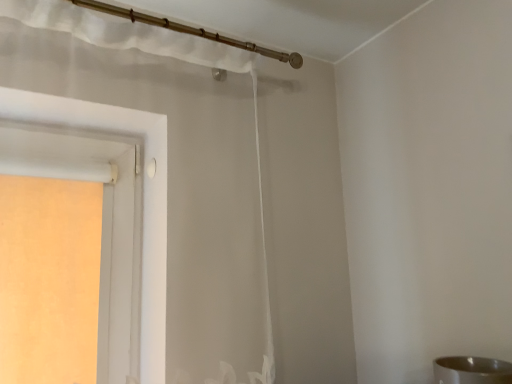
Question: From the image's perspective, does sheer white curtain at upper center appear higher than silver metallic sink at lower right?

Choices:
 (A) no
 (B) yes

Answer: (B)

Question: From the image's perspective, would you say sheer white curtain at upper center is shown under silver metallic sink at lower right?

Choices:
 (A) no
 (B) yes

Answer: (A)

Question: From a real-world perspective, does sheer white curtain at upper center stand above silver metallic sink at lower right?

Choices:
 (A) no
 (B) yes

Answer: (B)

Question: Can you see sheer white curtain at upper center touching silver metallic sink at lower right?

Choices:
 (A) no
 (B) yes

Answer: (A)

Question: Is sheer white curtain at upper center smaller than silver metallic sink at lower right?

Choices:
 (A) yes
 (B) no

Answer: (B)

Question: Can you confirm if sheer white curtain at upper center is thinner than silver metallic sink at lower right?

Choices:
 (A) no
 (B) yes

Answer: (A)

Question: Is silver metallic sink at lower right to the left of sheer white curtain at upper center from the viewer's perspective?

Choices:
 (A) yes
 (B) no

Answer: (B)

Question: Is silver metallic sink at lower right at the right side of sheer white curtain at upper center?

Choices:
 (A) yes
 (B) no

Answer: (A)

Question: Is silver metallic sink at lower right facing towards sheer white curtain at upper center?

Choices:
 (A) no
 (B) yes

Answer: (A)

Question: From a real-world perspective, is silver metallic sink at lower right beneath sheer white curtain at upper center?

Choices:
 (A) yes
 (B) no

Answer: (A)

Question: From the image's perspective, is silver metallic sink at lower right under sheer white curtain at upper center?

Choices:
 (A) no
 (B) yes

Answer: (B)

Question: Is silver metallic sink at lower right positioned far away from sheer white curtain at upper center?

Choices:
 (A) yes
 (B) no

Answer: (B)

Question: Choose the correct answer: Is silver metallic sink at lower right inside sheer white curtain at upper center or outside it?

Choices:
 (A) inside
 (B) outside

Answer: (B)